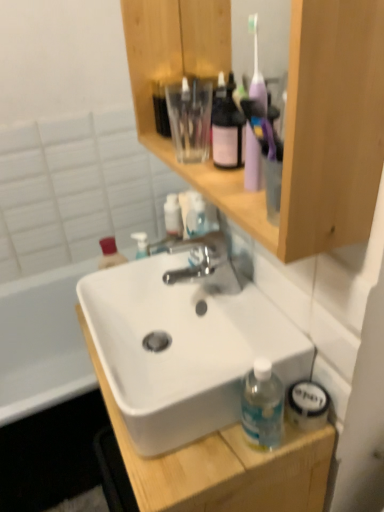
Question: Can you confirm if polished chrome faucet at center is smaller than white matte sink at center?

Choices:
 (A) yes
 (B) no

Answer: (A)

Question: Can you confirm if polished chrome faucet at center is bigger than white matte sink at center?

Choices:
 (A) no
 (B) yes

Answer: (A)

Question: Can you confirm if polished chrome faucet at center is shorter than white matte sink at center?

Choices:
 (A) no
 (B) yes

Answer: (B)

Question: From a real-world perspective, is polished chrome faucet at center on top of white matte sink at center?

Choices:
 (A) no
 (B) yes

Answer: (B)

Question: Would you say white matte sink at center is part of polished chrome faucet at center's contents?

Choices:
 (A) yes
 (B) no

Answer: (B)

Question: Does polished chrome faucet at center lie behind white matte sink at center?

Choices:
 (A) no
 (B) yes

Answer: (B)

Question: From a real-world perspective, is white matte sink at center beneath wooden cabinet at upper center?

Choices:
 (A) yes
 (B) no

Answer: (A)

Question: Is there a large distance between white matte sink at center and wooden cabinet at upper center?

Choices:
 (A) yes
 (B) no

Answer: (B)

Question: Is white matte sink at center touching wooden cabinet at upper center?

Choices:
 (A) no
 (B) yes

Answer: (A)

Question: Is white matte sink at center shorter than wooden cabinet at upper center?

Choices:
 (A) yes
 (B) no

Answer: (B)

Question: From a real-world perspective, is white matte sink at center on wooden cabinet at upper center?

Choices:
 (A) yes
 (B) no

Answer: (B)

Question: Considering the relative positions of white matte sink at center and wooden cabinet at upper center in the image provided, is white matte sink at center behind wooden cabinet at upper center?

Choices:
 (A) no
 (B) yes

Answer: (B)

Question: From a real-world perspective, is polished chrome faucet at center below wooden cabinet at upper center?

Choices:
 (A) no
 (B) yes

Answer: (B)